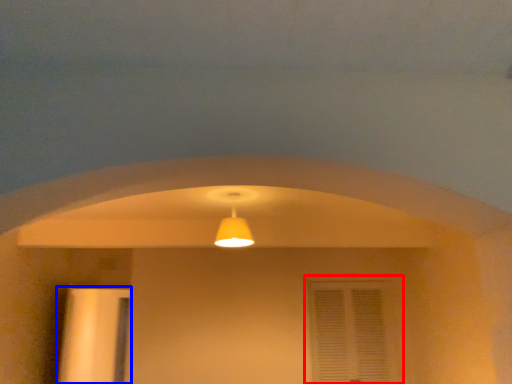
Question: Which point is further to the camera, window (highlighted by a red box) or door (highlighted by a blue box)?

Choices:
 (A) window
 (B) door

Answer: (B)